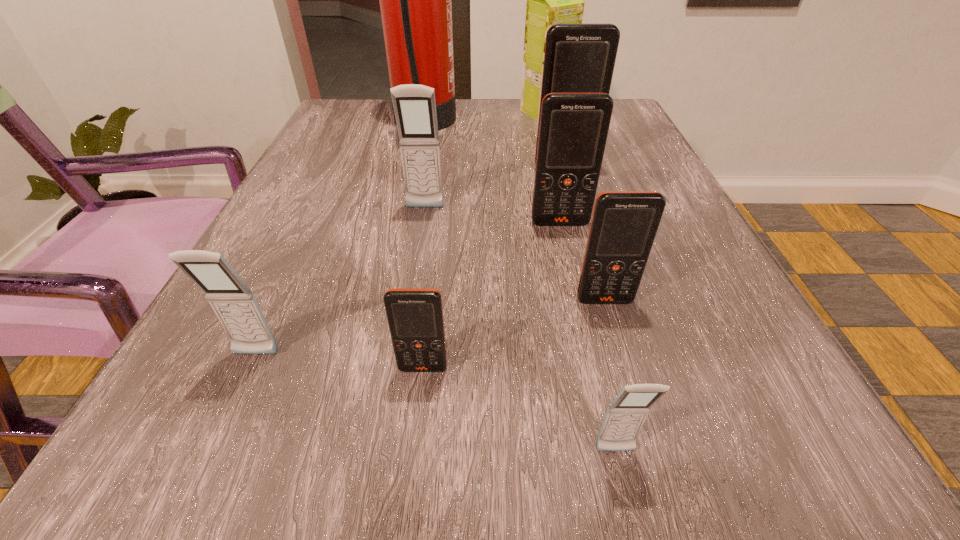
Where is `soya milk that is at the right edge`? The image size is (960, 540). soya milk that is at the right edge is located at coordinates tap(551, 0).

The height and width of the screenshot is (540, 960). Identify the location of object that is at the far left corner. (415, 0).

Where is `object located at the far right corner`? The image size is (960, 540). object located at the far right corner is located at coordinates (551, 0).

Identify the location of vacant point at the far edge. Image resolution: width=960 pixels, height=540 pixels. (467, 117).

Where is `free space at the near edge of the desktop`? Image resolution: width=960 pixels, height=540 pixels. free space at the near edge of the desktop is located at coordinates (x=412, y=509).

This screenshot has height=540, width=960. In order to click on vacant space at the left edge of the desktop in this screenshot , I will do `click(341, 241)`.

At what (x,y) coordinates should I click in order to perform the action: click on vacant area at the right edge. Please return your answer as a coordinate pair (x, y). The image size is (960, 540). Looking at the image, I should click on (668, 292).

In the image, there is a desktop. Where is `vacant space at the far left corner`? vacant space at the far left corner is located at coordinates (392, 109).

You are a GUI agent. You are given a task and a screenshot of the screen. Output one action in this format:
    pyautogui.click(x=<x>, y=<y>)
    Task: Click on the vacant region at the far right corner of the desktop
    This screenshot has height=540, width=960.
    Given the screenshot: What is the action you would take?
    (625, 125)

Where is `free space between the green soya milk and the second nearest cellular telephone`? free space between the green soya milk and the second nearest cellular telephone is located at coordinates (484, 240).